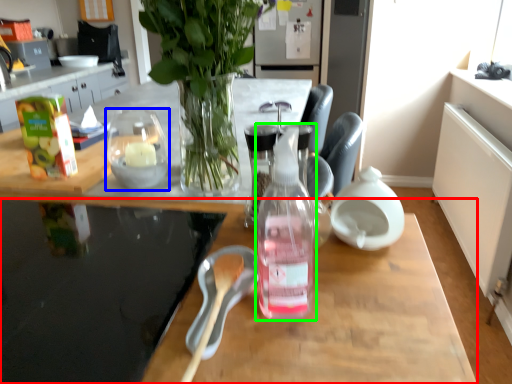
Question: Estimate the real-world distances between objects in this image. Which object is closer to desk (highlighted by a red box), tableware (highlighted by a blue box) or bottle (highlighted by a green box)?

Choices:
 (A) tableware
 (B) bottle

Answer: (B)